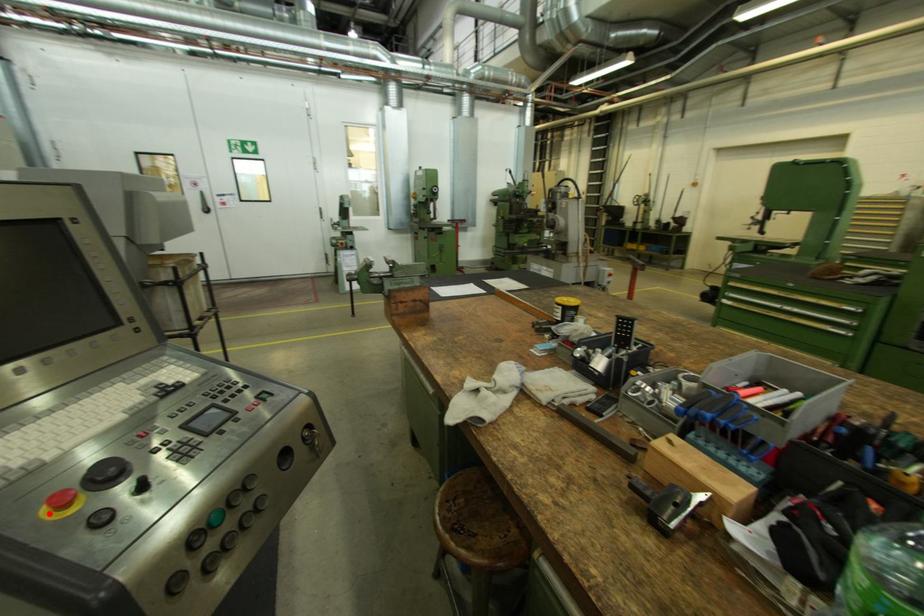
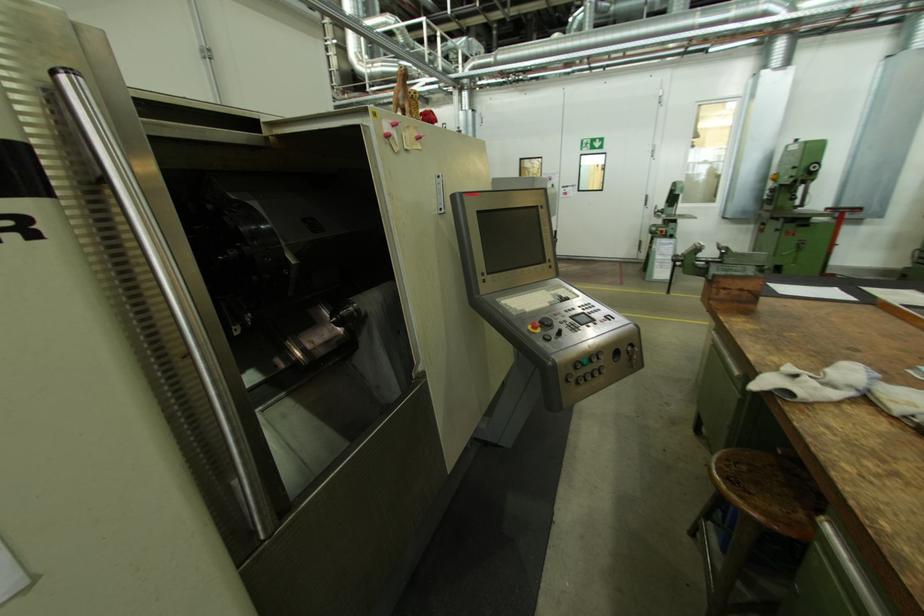
Where in the second image is the point corresponding to the highlighted location from the first image?

(535, 329)